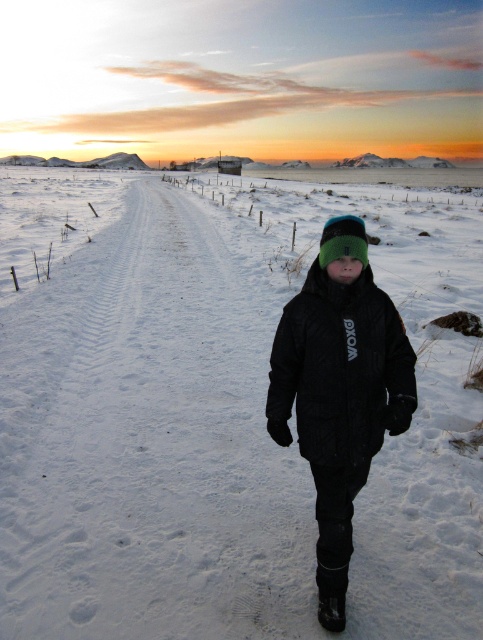
Question: Considering the relative positions of white fluffy snow at center and black quilted jacket at center in the image provided, where is white fluffy snow at center located with respect to black quilted jacket at center?

Choices:
 (A) below
 (B) above

Answer: (B)

Question: Which object appears closest to the camera in this image?

Choices:
 (A) black quilted jacket at center
 (B) green knit hat at center

Answer: (B)

Question: Which object is the farthest from the white fluffy snow at center?

Choices:
 (A) black quilted jacket at center
 (B) green knit hat at center

Answer: (B)

Question: Can you confirm if white fluffy snow at center is thinner than green knit hat at center?

Choices:
 (A) no
 (B) yes

Answer: (A)

Question: Is white fluffy snow at center to the right of green knit hat at center from the viewer's perspective?

Choices:
 (A) yes
 (B) no

Answer: (B)

Question: Which point is farther from the camera taking this photo?

Choices:
 (A) (127, 339)
 (B) (337, 250)

Answer: (A)